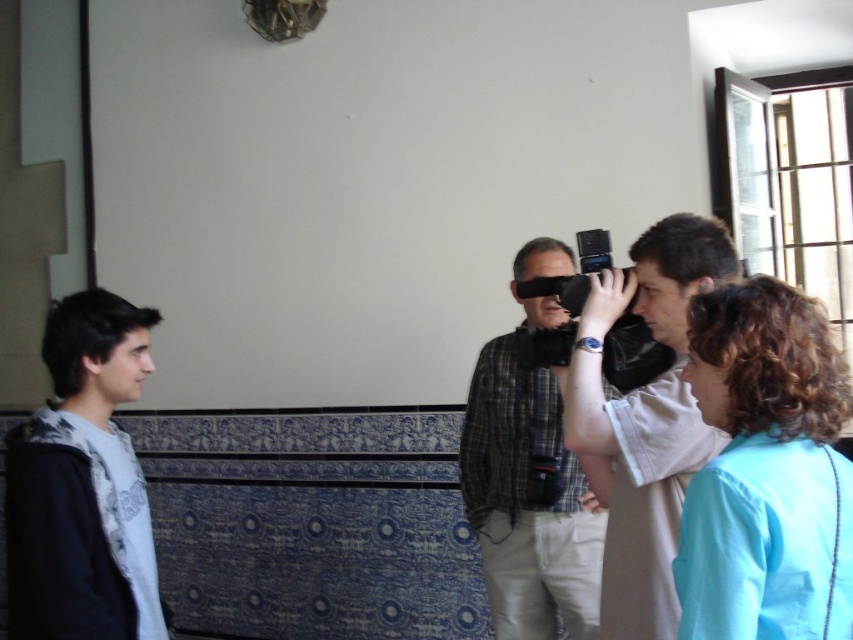
Is light gray hoodie at left to the left of plaid shirt at center from the viewer's perspective?

Correct, you'll find light gray hoodie at left to the left of plaid shirt at center.

What do you see at coordinates (83, 484) in the screenshot?
I see `light gray hoodie at left` at bounding box center [83, 484].

I want to click on light gray hoodie at left, so click(83, 484).

Does light blue fabric at lower right appear on the left side of light gray hoodie at left?

Incorrect, light blue fabric at lower right is not on the left side of light gray hoodie at left.

Does light blue fabric at lower right have a greater width compared to light gray hoodie at left?

Incorrect, light blue fabric at lower right's width does not surpass light gray hoodie at left's.

This screenshot has width=853, height=640. I want to click on light blue fabric at lower right, so click(x=766, y=472).

At what (x,y) coordinates should I click in order to perform the action: click on light blue fabric at lower right. Please return your answer as a coordinate pair (x, y). Looking at the image, I should click on (766, 472).

Can you confirm if light blue fabric at lower right is positioned to the left of plaid shirt at center?

In fact, light blue fabric at lower right is to the right of plaid shirt at center.

Does light blue fabric at lower right appear under plaid shirt at center?

No.

Where is `light blue fabric at lower right`? Image resolution: width=853 pixels, height=640 pixels. light blue fabric at lower right is located at coordinates [x=766, y=472].

This screenshot has width=853, height=640. I want to click on light blue fabric at lower right, so click(766, 472).